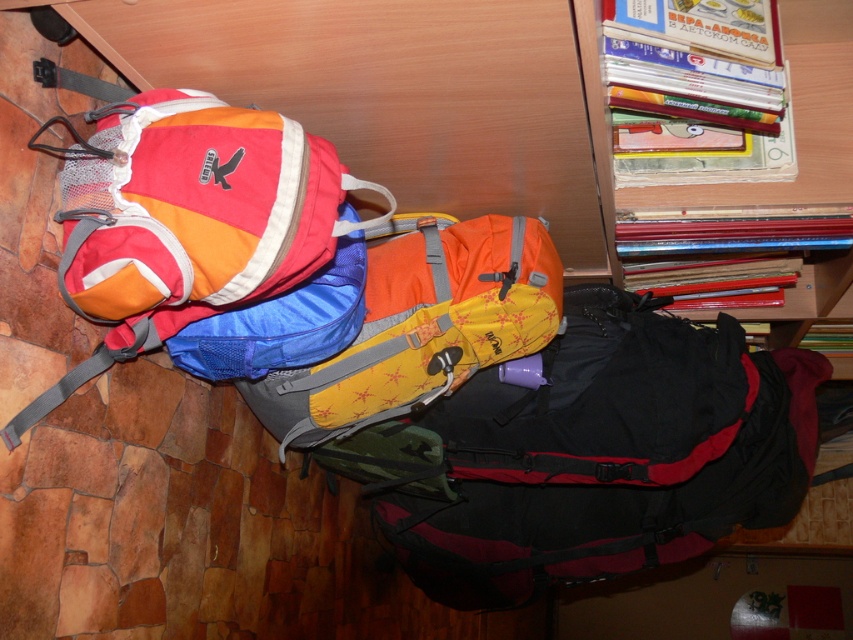
Is matte black backpack at center above wooden bookshelf at upper right?

No.

This screenshot has height=640, width=853. I want to click on matte black backpack at center, so click(x=606, y=456).

Between yellow fabric backpack at center and wooden bookshelf at upper right, which one has more height?

With more height is yellow fabric backpack at center.

Is yellow fabric backpack at center closer to the viewer compared to wooden bookshelf at upper right?

No, yellow fabric backpack at center is further to the viewer.

At what (x,y) coordinates should I click in order to perform the action: click on yellow fabric backpack at center. Please return your answer as a coordinate pair (x, y). Looking at the image, I should click on (422, 326).

What do you see at coordinates (189, 220) in the screenshot?
I see `matte nylon backpack at left` at bounding box center [189, 220].

Is matte nylon backpack at left closer to the viewer compared to yellow fabric backpack at center?

Yes, matte nylon backpack at left is closer to the viewer.

Is point (135, 326) closer to viewer compared to point (519, 300)?

Yes, it is in front of point (519, 300).

Identify the location of matte nylon backpack at left. This screenshot has width=853, height=640. pos(189,220).